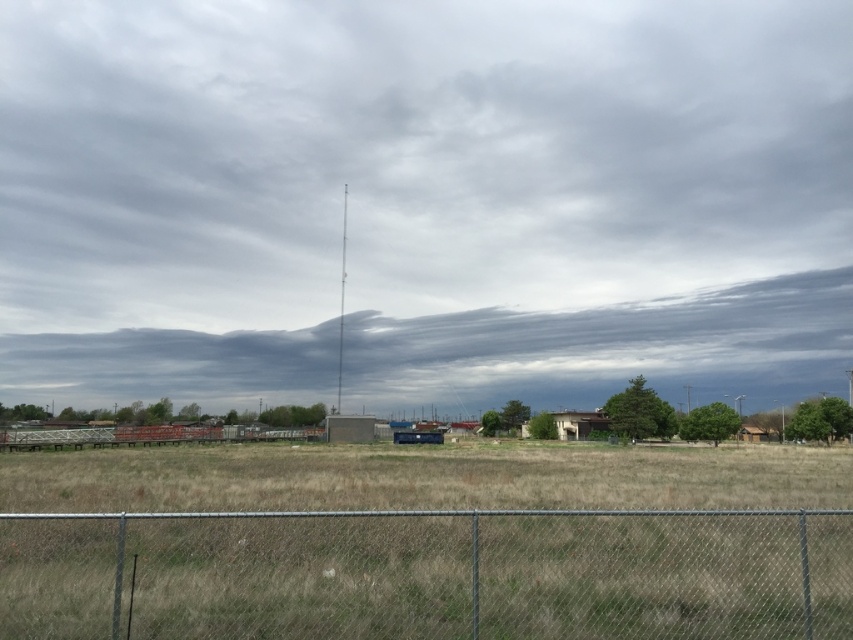
Question: Among these points, which one is nearest to the camera?

Choices:
 (A) (341, 234)
 (B) (421, 572)
 (C) (190, 218)
 (D) (839, 300)

Answer: (B)

Question: Does gray cloudy sky at center come in front of gray/cloudy sky at center?

Choices:
 (A) no
 (B) yes

Answer: (B)

Question: Which point is farther to the camera?

Choices:
 (A) gray cloudy sky at center
 (B) gray/cloudy sky at center
 (C) smooth concrete pole at center

Answer: (B)

Question: Does gray cloudy sky at center appear under metal chain-link fence at lower center?

Choices:
 (A) no
 (B) yes

Answer: (A)

Question: Which point is closer to the camera taking this photo?

Choices:
 (A) (233, 520)
 (B) (572, 326)

Answer: (A)

Question: Is metal chain-link fence at lower center smaller than gray/cloudy sky at center?

Choices:
 (A) no
 (B) yes

Answer: (B)